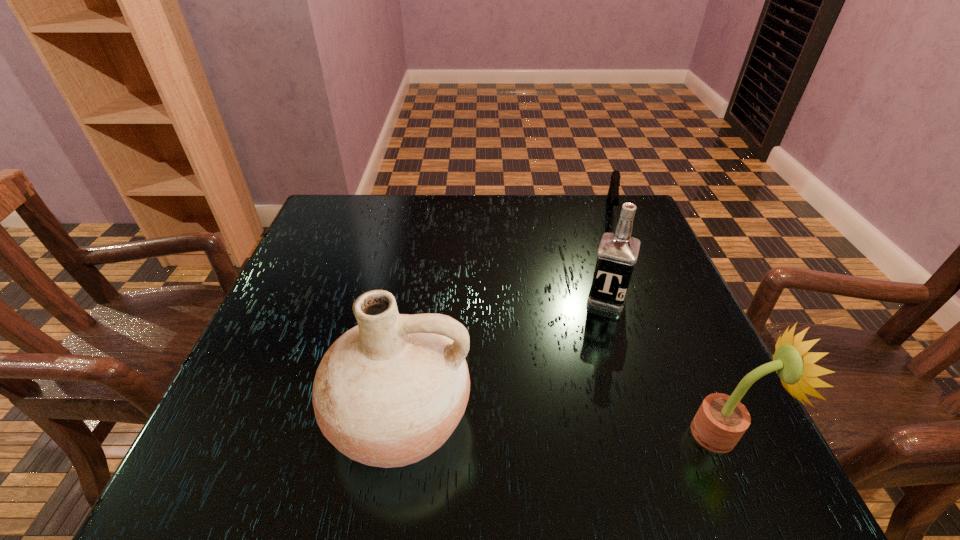
This screenshot has height=540, width=960. What are the coordinates of `object identified as the second closest to the pistol` in the screenshot? It's located at (720, 422).

Identify which object is the nearest to the shortest object. Please provide its 2D coordinates. Your answer should be formatted as a tuple, i.e. [(x, y)], where the tuple contains the x and y coordinates of a point satisfying the conditions above.

[(617, 254)]

Locate an element on the screen. The width and height of the screenshot is (960, 540). free spot that satisfies the following two spatial constraints: 1. to pour from the handle of the sunflower; 2. on the face of the leftmost object is located at coordinates tap(397, 434).

In order to click on vacant region that satisfies the following two spatial constraints: 1. to pour from the handle of the leftmost object; 2. on the face of the sunflower in this screenshot , I will do `click(397, 434)`.

Where is `vacant space that satisfies the following two spatial constraints: 1. to pour from the handle of the sunflower; 2. on the face of the leftmost object`? The image size is (960, 540). vacant space that satisfies the following two spatial constraints: 1. to pour from the handle of the sunflower; 2. on the face of the leftmost object is located at coordinates (397, 434).

The width and height of the screenshot is (960, 540). Identify the location of free location that satisfies the following two spatial constraints: 1. to pour from the handle of the pottery; 2. on the face of the sunflower. (397, 434).

Where is `vacant point that satisfies the following two spatial constraints: 1. to pour from the handle of the pottery; 2. on the face of the sunflower`? The width and height of the screenshot is (960, 540). vacant point that satisfies the following two spatial constraints: 1. to pour from the handle of the pottery; 2. on the face of the sunflower is located at coordinates (397, 434).

Where is `free location that satisfies the following two spatial constraints: 1. on the front side of the sunflower; 2. on the face of the shortest object`? This screenshot has width=960, height=540. free location that satisfies the following two spatial constraints: 1. on the front side of the sunflower; 2. on the face of the shortest object is located at coordinates (700, 434).

Where is `blank space that satisfies the following two spatial constraints: 1. to pour from the handle of the pottery; 2. on the face of the sunflower`? The height and width of the screenshot is (540, 960). blank space that satisfies the following two spatial constraints: 1. to pour from the handle of the pottery; 2. on the face of the sunflower is located at coordinates (397, 434).

In order to click on vacant area that satisfies the following two spatial constraints: 1. to pour from the handle of the pottery; 2. on the face of the sunflower in this screenshot , I will do (x=397, y=434).